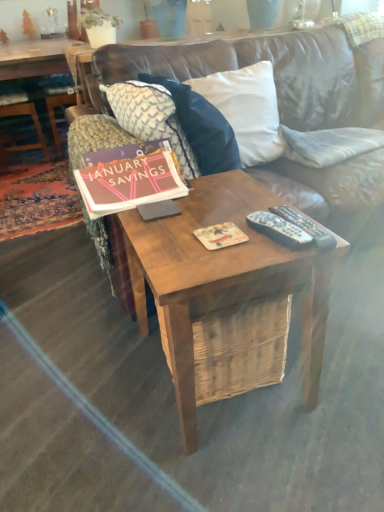
This screenshot has width=384, height=512. I want to click on vacant area that is situated to the right of woven brown basket at center, so click(345, 366).